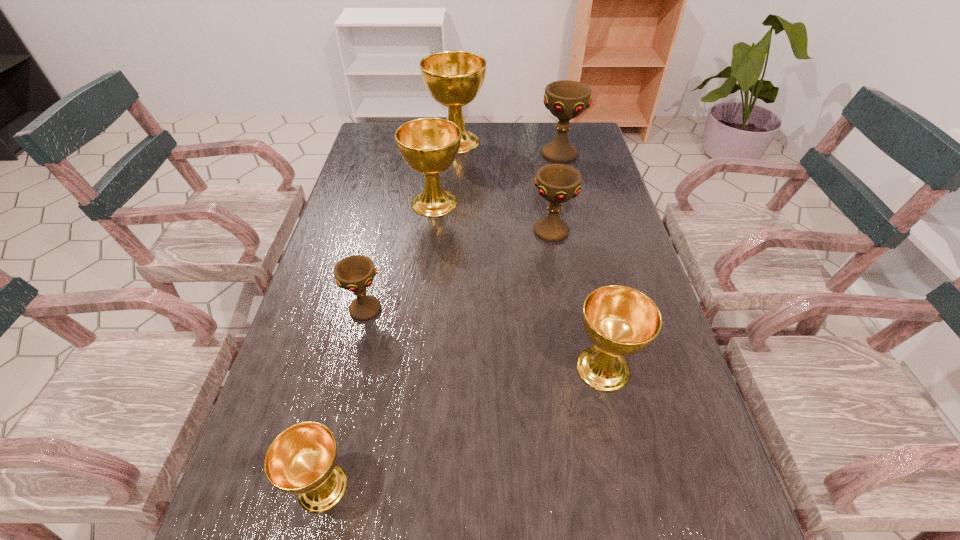
Locate an element on the screen. free space between the fifth farthest object and the second farthest red chalice is located at coordinates (458, 271).

At what (x,y) coordinates should I click in order to perform the action: click on object that can be found as the fourth closest to the second farthest gold chalice. Please return your answer as a coordinate pair (x, y). Looking at the image, I should click on (355, 273).

Choose which object is the sixth nearest neighbor to the nearest gold chalice. Please provide its 2D coordinates. Your answer should be formatted as a tuple, i.e. [(x, y)], where the tuple contains the x and y coordinates of a point satisfying the conditions above.

[(566, 99)]

Select which chalice appears as the second closest to the nearest gold chalice. Please provide its 2D coordinates. Your answer should be formatted as a tuple, i.e. [(x, y)], where the tuple contains the x and y coordinates of a point satisfying the conditions above.

[(620, 321)]

Point out which chalice is positioned as the sixth nearest to the second biggest red chalice. Please provide its 2D coordinates. Your answer should be formatted as a tuple, i.e. [(x, y)], where the tuple contains the x and y coordinates of a point satisfying the conditions above.

[(301, 460)]

Locate an element on the screen. This screenshot has height=540, width=960. gold chalice that stands as the fourth closest to the farthest red chalice is located at coordinates click(301, 460).

Identify the location of the closest gold chalice to the third nearest chalice. (429, 146).

Where is `red chalice that is the second nearest to the third nearest chalice`? This screenshot has width=960, height=540. red chalice that is the second nearest to the third nearest chalice is located at coordinates (566, 99).

Identify which red chalice is the closest to the farthest red chalice. Please provide its 2D coordinates. Your answer should be formatted as a tuple, i.e. [(x, y)], where the tuple contains the x and y coordinates of a point satisfying the conditions above.

[(557, 183)]

Locate an element on the screen. The image size is (960, 540). blank area in the image that satisfies the following two spatial constraints: 1. on the back side of the nearest gold chalice; 2. on the left side of the sixth farthest chalice is located at coordinates (350, 368).